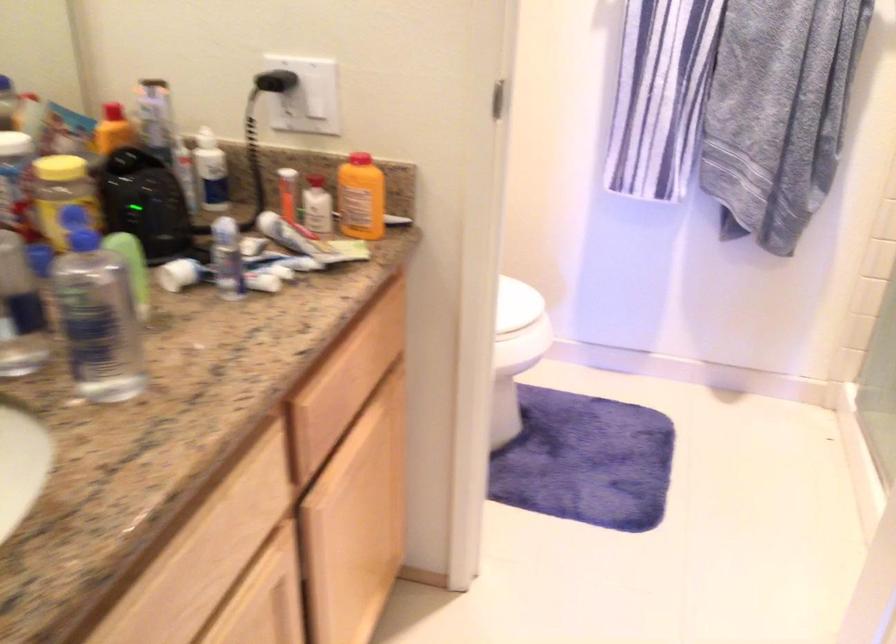
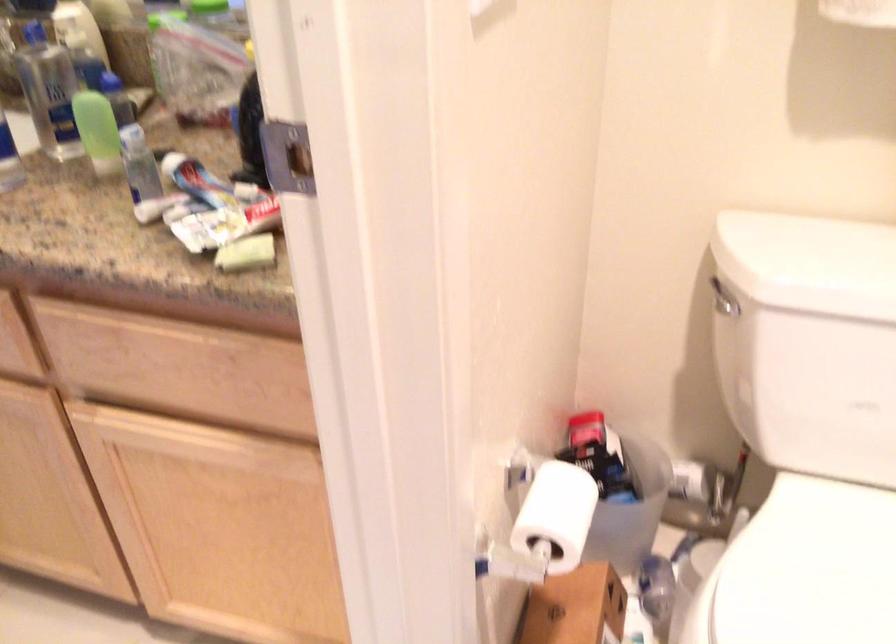
Locate, in the second image, the point that corresponds to [442,310] in the first image.

(556, 515)